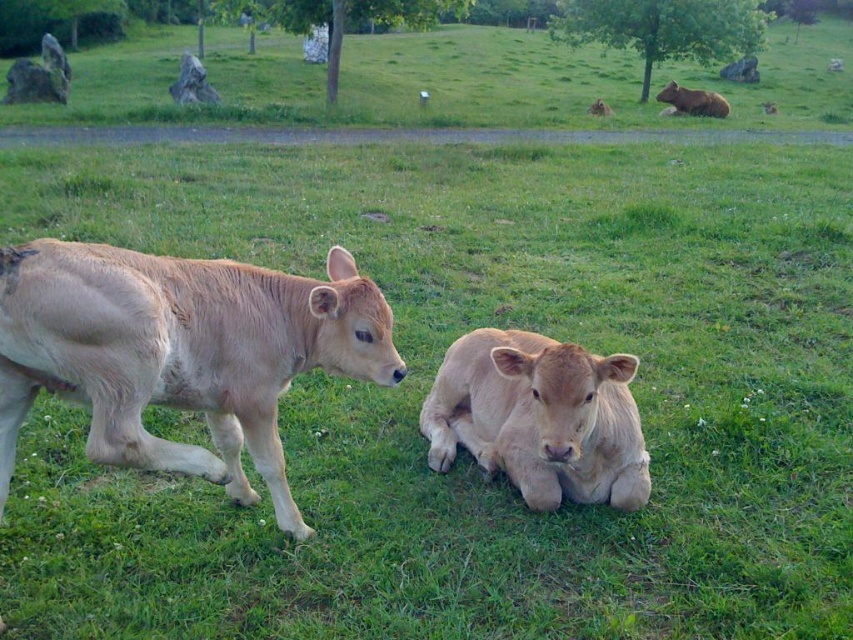
From the picture: Is light brown fur at left thinner than brown furry cow at upper right?

No.

Who is more forward, (4,394) or (602,115)?

Answer: Point (4,394) is more forward.

Locate an element on the screen. The width and height of the screenshot is (853, 640). light brown fur at left is located at coordinates (180, 353).

Looking at this image, does light brown fur at center have a lesser height compared to brown furry cow at upper right?

No, light brown fur at center is not shorter than brown furry cow at upper right.

Between light brown fur at center and brown furry cow at upper right, which one is positioned higher?

brown furry cow at upper right is above.

Is point (549, 474) less distant than point (610, 108)?

Yes, point (549, 474) is closer to viewer.

Find the location of a particular element. The height and width of the screenshot is (640, 853). light brown fur at center is located at coordinates (538, 417).

Does point (560, 500) come farther from viewer compared to point (660, 97)?

No, it is not.

Can you confirm if light brown fur at center is positioned above brown furry bear at upper right?

Incorrect, light brown fur at center is not positioned above brown furry bear at upper right.

Is point (544, 458) closer to camera compared to point (674, 86)?

Yes.

Identify the location of light brown fur at center. (538, 417).